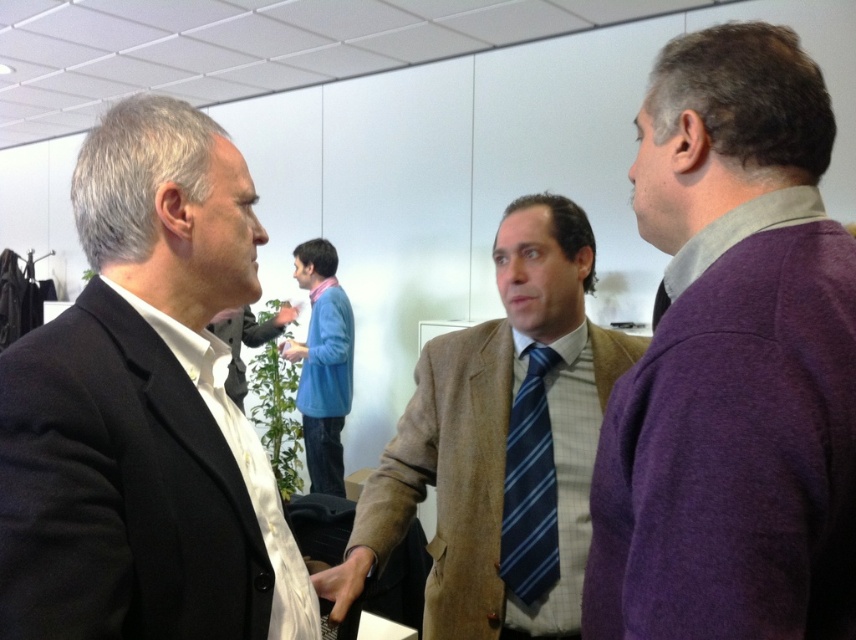
Does black matte suit at left have a larger size compared to matte black camera at center?

No.

In the scene shown: Who is positioned more to the right, black matte suit at left or matte black camera at center?

Positioned to the right is black matte suit at left.

In order to click on black matte suit at left in this screenshot , I will do `click(146, 410)`.

Is point (204, 528) positioned after point (617, 355)?

No, it is not.

Between point (28, 340) and point (467, 580), which one is positioned in front?

Point (28, 340)

The height and width of the screenshot is (640, 856). Describe the element at coordinates (146, 410) in the screenshot. I see `black matte suit at left` at that location.

Locate an element on the screen. black matte suit at left is located at coordinates (146, 410).

Can you confirm if purple wool sweater at right is positioned below blue striped tie at center?

No.

What do you see at coordinates (732, 362) in the screenshot? I see `purple wool sweater at right` at bounding box center [732, 362].

Between point (848, 618) and point (544, 381), which one is positioned in front?

Point (848, 618)

Identify the location of purple wool sweater at right. This screenshot has height=640, width=856. (732, 362).